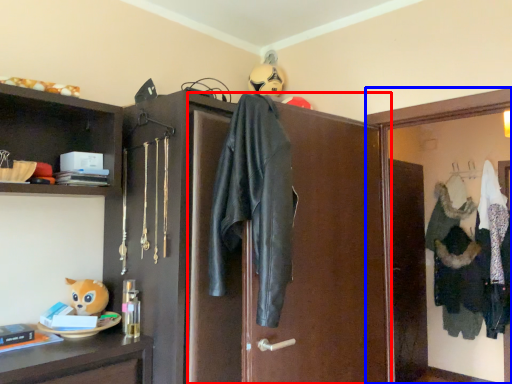
Question: Which object appears closest to the camera in this image, screen door (highlighted by a red box) or medicine cabinet (highlighted by a blue box)?

Choices:
 (A) screen door
 (B) medicine cabinet

Answer: (A)